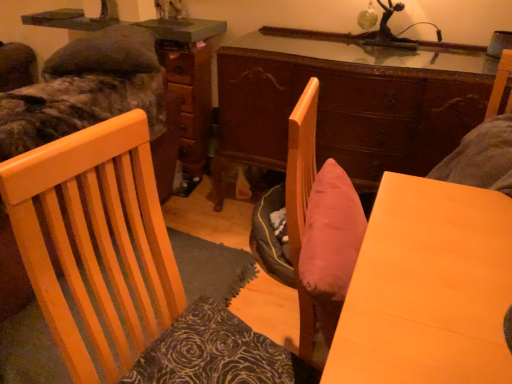
Question: Considering the relative positions of camouflage fabric bed at upper left, acting as the second bed starting from the bottom, and dark brown textured pillow at lower left in the image provided, is camouflage fabric bed at upper left, acting as the second bed starting from the bottom, to the left or to the right of dark brown textured pillow at lower left?

Choices:
 (A) left
 (B) right

Answer: (A)

Question: Does point (3, 94) appear closer or farther from the camera than point (208, 306)?

Choices:
 (A) closer
 (B) farther

Answer: (B)

Question: Which of these objects is positioned farthest from the dark brown textured pillow at lower left?

Choices:
 (A) wooden dresser at center
 (B) wooden table at center
 (C) wooden desk at center
 (D) velvet green bed at upper left, arranged as the second bed when viewed from the top
 (E) camouflage fabric bed at upper left, acting as the second bed starting from the bottom

Answer: (A)

Question: Estimate the real-world distances between objects in this image. Which object is closer to the wooden table at center?

Choices:
 (A) wooden chair at center
 (B) wooden dresser at center
 (C) wooden desk at center
 (D) velvet green bed at upper left, the first bed from the bottom
 (E) camouflage fabric bed at upper left, acting as the second bed starting from the bottom

Answer: (A)